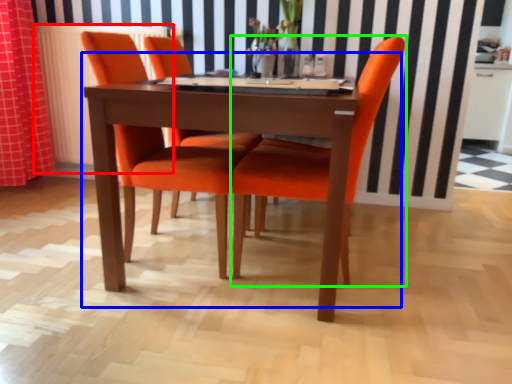
Question: Which is nearer to the radiator (highlighted by a red box)? kitchen & dining room table (highlighted by a blue box) or chair (highlighted by a green box).

Choices:
 (A) kitchen & dining room table
 (B) chair

Answer: (A)